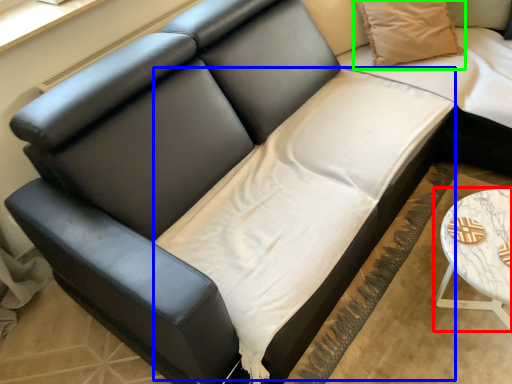
Question: Based on their relative distances, which object is farther from table (highlighted by a red box)? Choose from sheet (highlighted by a blue box) and pillow (highlighted by a green box).

Choices:
 (A) sheet
 (B) pillow

Answer: (B)